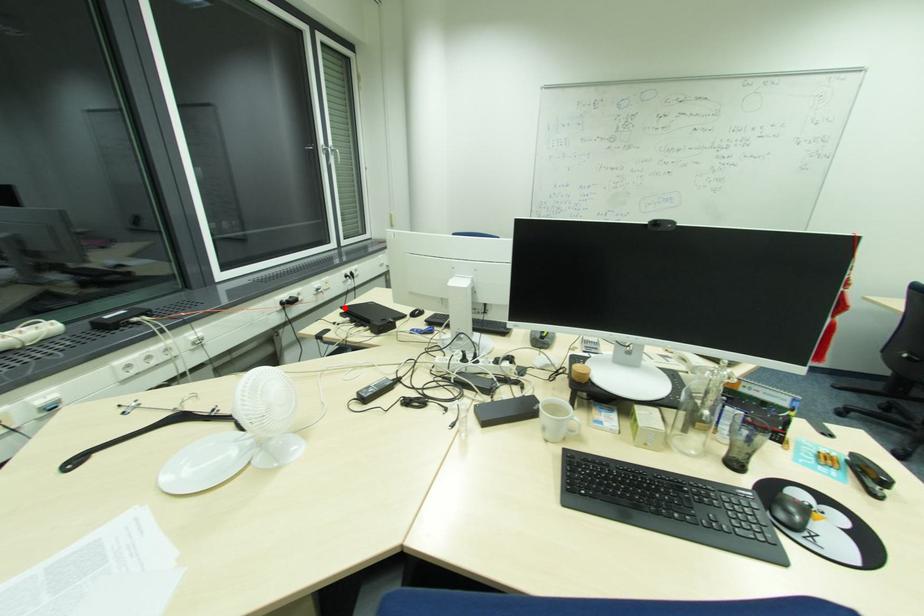
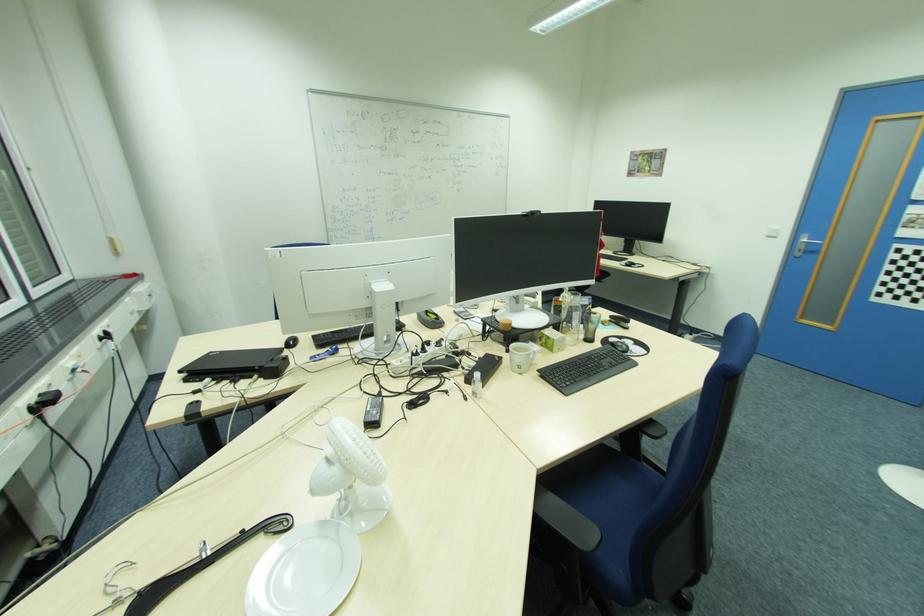
Find the pixel in the second image that matches the highlighted location in the first image.

(183, 371)